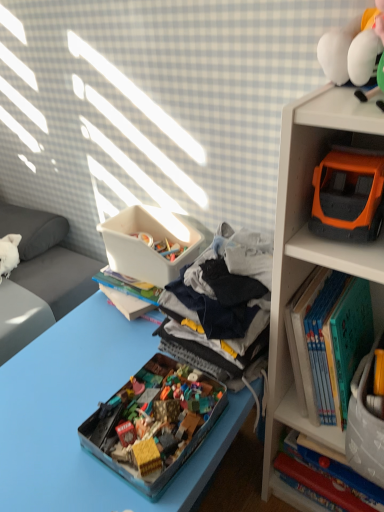
Find the location of a particular element. vacant region to the left of gray cotton clothes at center is located at coordinates (95, 359).